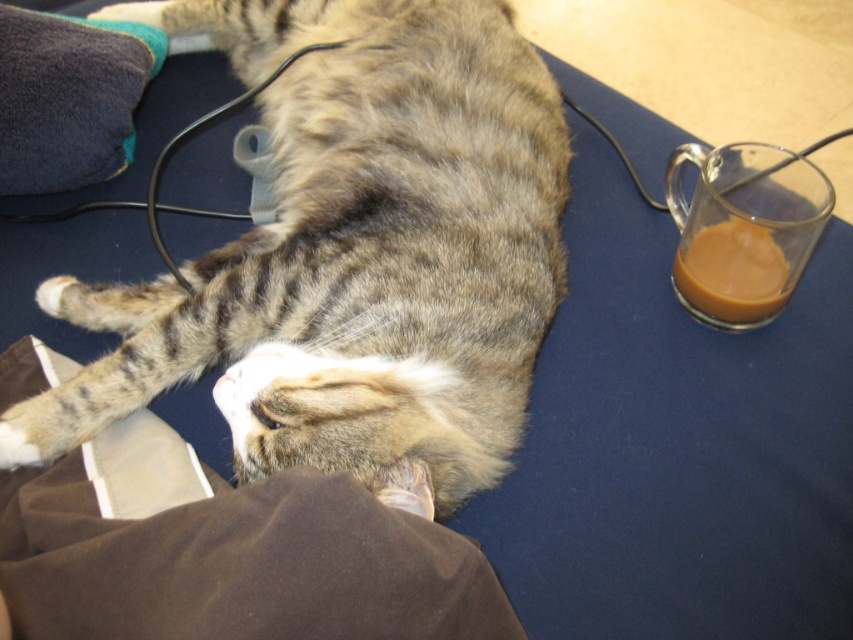
You are a delivery person who needs to place a small package on the dark blue surface where the tabby fur cat at center is resting. The package is 10 cm wide. Can you place it near the translucent glass mug at right without disturbing the cat?

Answer: The tabby fur cat at center might be wider than the translucent glass mug at right, but since the package is only 10 cm wide, there should be enough space near the mug as long as it doesn

You are a photographer trying to capture the tabby fur cat at center. The camera is positioned at the point marked by coordinates point (350, 252). Can you confirm if the cat is facing towards the camera or away from it?

The point marked by coordinates point (350, 252) marks tabby fur cat at center, so the camera is positioned directly on the cat. Therefore, the cat is facing towards the camera.

You are a delivery person who just arrived at the house and see the tabby fur cat at center and the translucent glass mug at right. You need to place a small package on the dark blue surface without disturbing the cat or the mug. Where should you put it?

The tabby fur cat at center is taller than the translucent glass mug at right, so place the package in an area that is not occupied by either, such as the bottom left corner near the brown fabric where the cat isnnt touching.